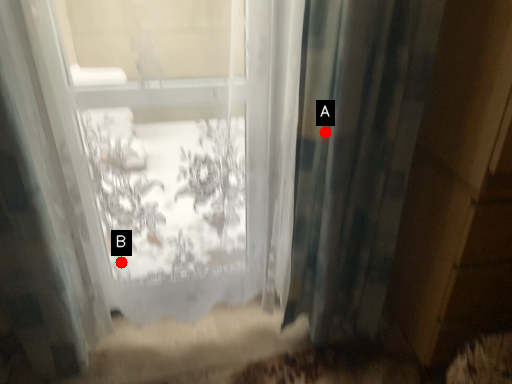
Question: Two points are circled on the image, labeled by A and B beside each circle. Which point appears closest to the camera in this image?

Choices:
 (A) A is closer
 (B) B is closer

Answer: (A)